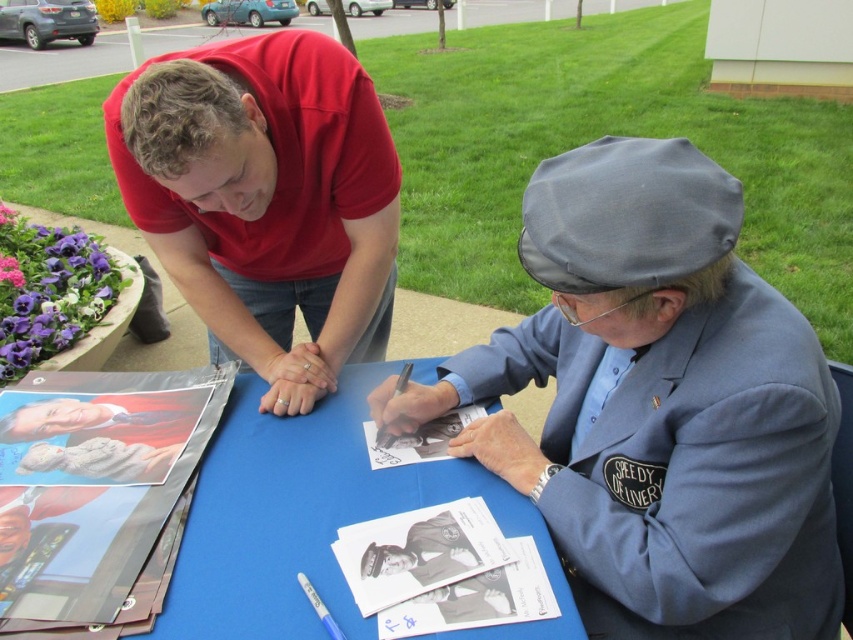
Where is the gray fabric cap at center located in the image?

The gray fabric cap at center is located at point coordinates of (659, 404).

You are a photographer trying to place a matte white frame on the table between the red cotton shirt at upper left and the smooth glossy photo at lower left. Can you fit the frame there without overlapping either object?

The red cotton shirt at upper left might be wider than smooth glossy photo at lower left, so there may not be enough space between them to fit the matte white frame without overlapping.